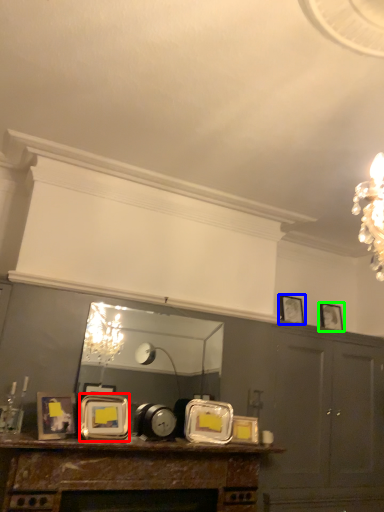
Question: Which object is positioned farthest from picture frame (highlighted by a red box)? Select from picture frame (highlighted by a blue box) and picture frame (highlighted by a green box).

Choices:
 (A) picture frame
 (B) picture frame

Answer: (B)